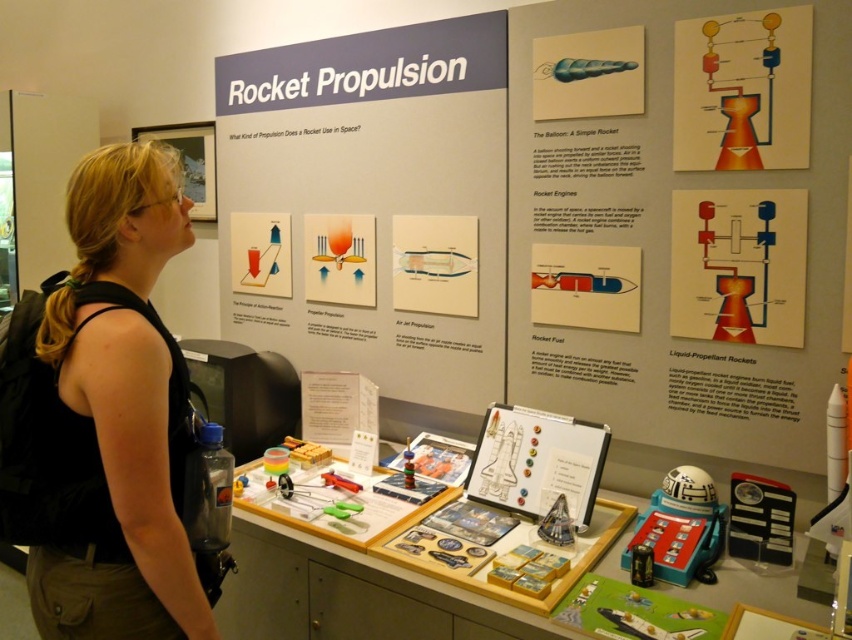
You are standing in front of the rocket propulsion exhibit and notice a black fabric at left. Can you determine its position relative to the large blue banner at the top?

The black fabric at left is located at point 0.653 on the horizontal axis and 0.123 on the vertical axis, which places it to the left and below the large blue banner at the top.

You are a visitor at the exhibit and want to take a photo of both the black fabric at left and the white matte rocket at lower right. Your camera has a maximum focus range of 5 feet. Can you capture both objects in focus without moving your position?

The distance between the black fabric at left and the white matte rocket at lower right is 5.13 feet, which exceeds the camera maximum focus range of 5 feet. Therefore, you cannot capture both objects in focus without moving your position.

You are a student visiting the rocket propulsion exhibit. You need to compare the height of the matte red rocket engine diagram at center right and the white matte rocket at lower right. Which one is taller?

The matte red rocket engine diagram at center right is much taller than the white matte rocket at lower right.